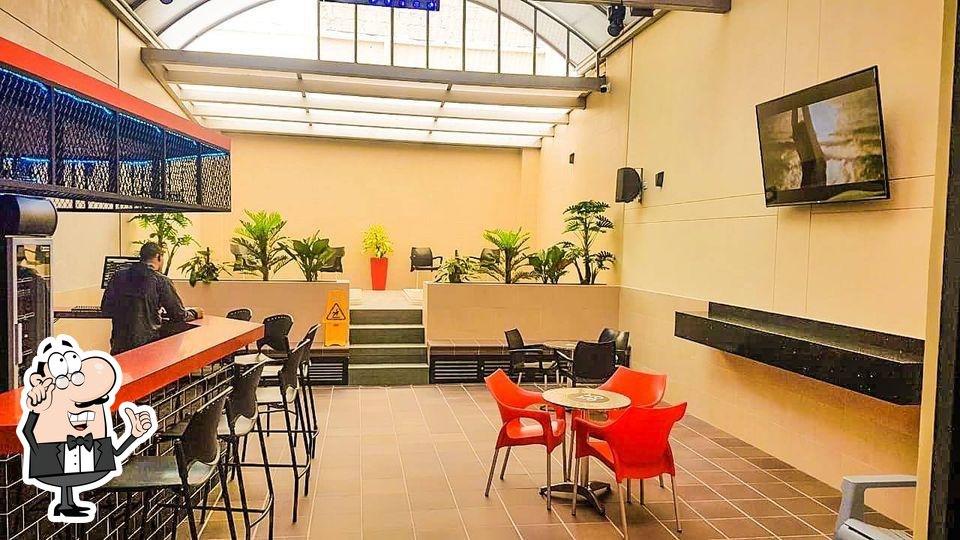
Image resolution: width=960 pixels, height=540 pixels. I want to click on orange surface of bar, so click(156, 346).